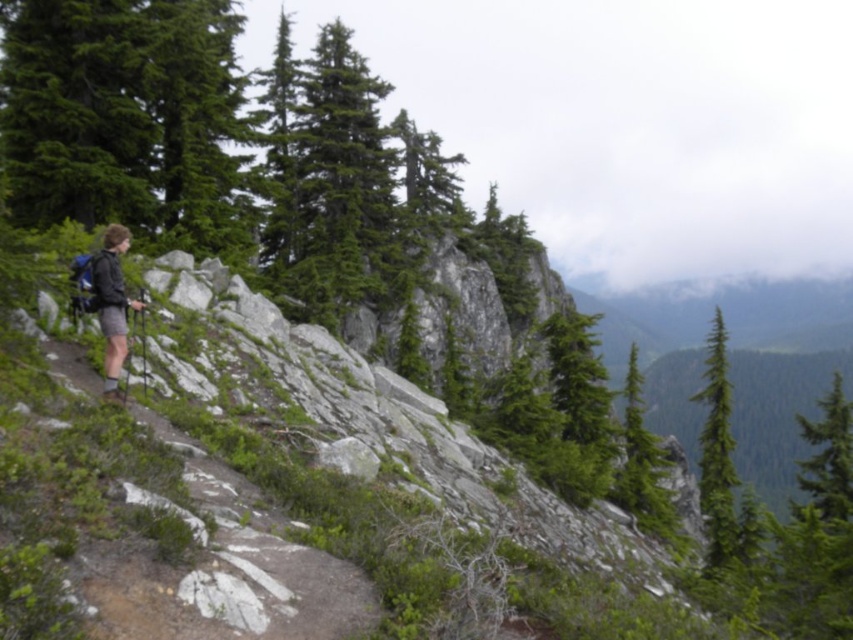
Is green matte tree at right thinner than matte black backpack at left?

In fact, green matte tree at right might be wider than matte black backpack at left.

Between point (718, 371) and point (112, 336), which one is positioned in front?

Point (112, 336) is more forward.

I want to click on green matte tree at right, so click(717, 452).